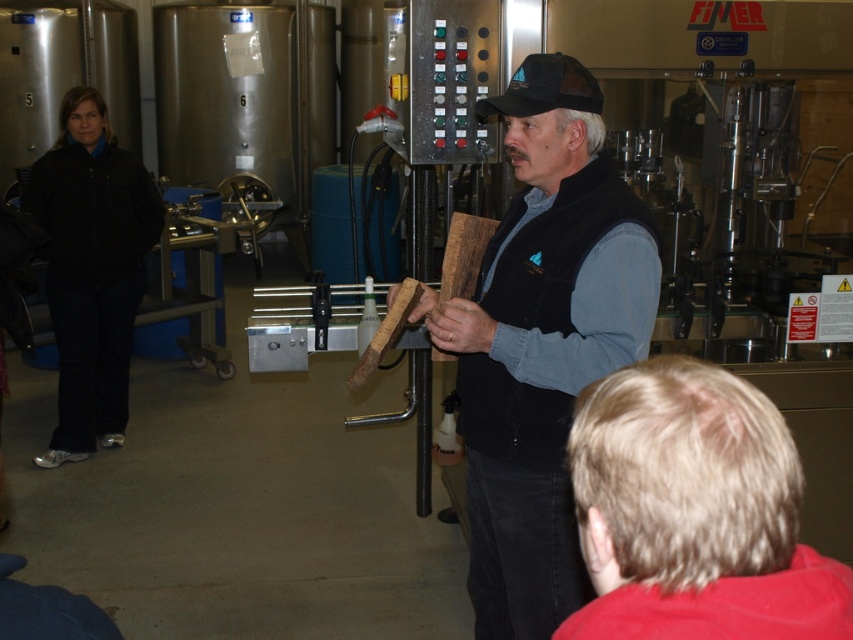
You are a tour guide at the brewery and want to show visitors the wooden plank at center and the blonde hair at lower right. How far apart are these two features?

The wooden plank at center is 95.13 centimeters from blonde hair at lower right.

You are a visitor at the brewery and see the wooden plank at center and the blonde hair at lower right. Which object is located to the left of the other?

The wooden plank at center is positioned on the left side of blonde hair at lower right.

You are a visitor at the brewery and see two points marked in the image. Which point is closer to you, point (505, 568) or point (657, 611)?

Point (505, 568) is closer to you than point (657, 611).